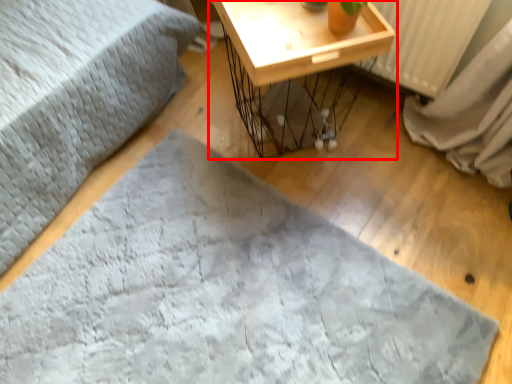
Question: Observing the image, what is the correct spatial positioning of table (annotated by the red box) in reference to sheet?

Choices:
 (A) left
 (B) right

Answer: (B)